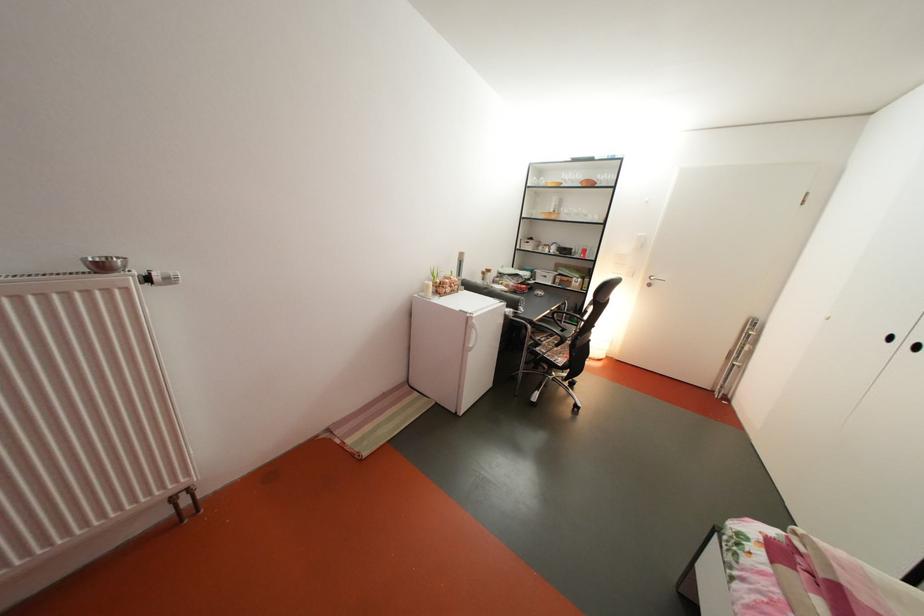
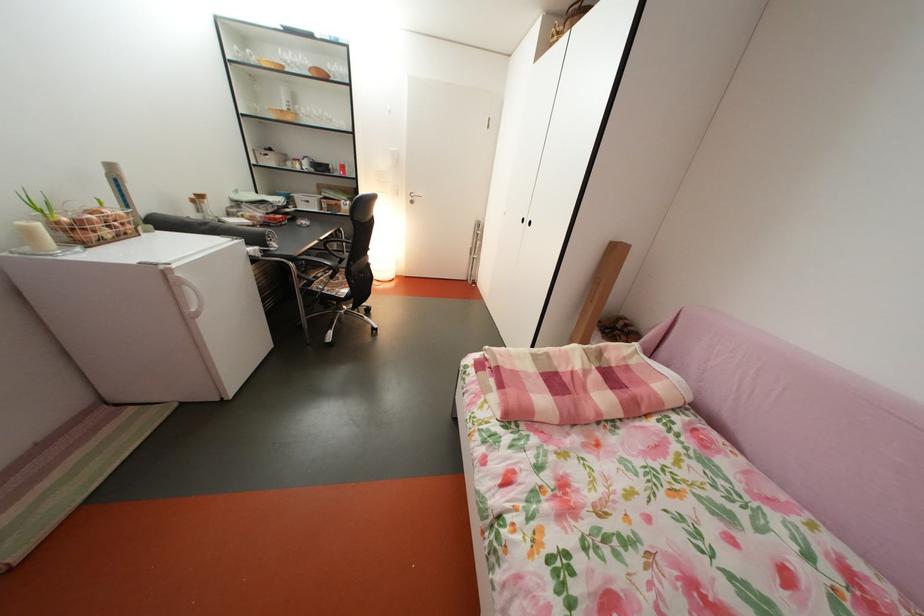
Where in the second image is the point corresponding to the point at 542,329 from the first image?

(304, 265)